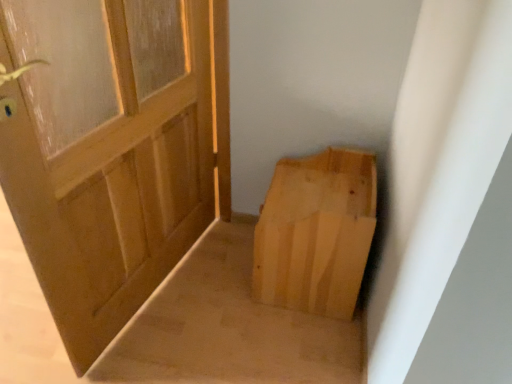
I want to click on free space between natural wood cardboard box at lower right and natural wood door at left, so click(x=218, y=304).